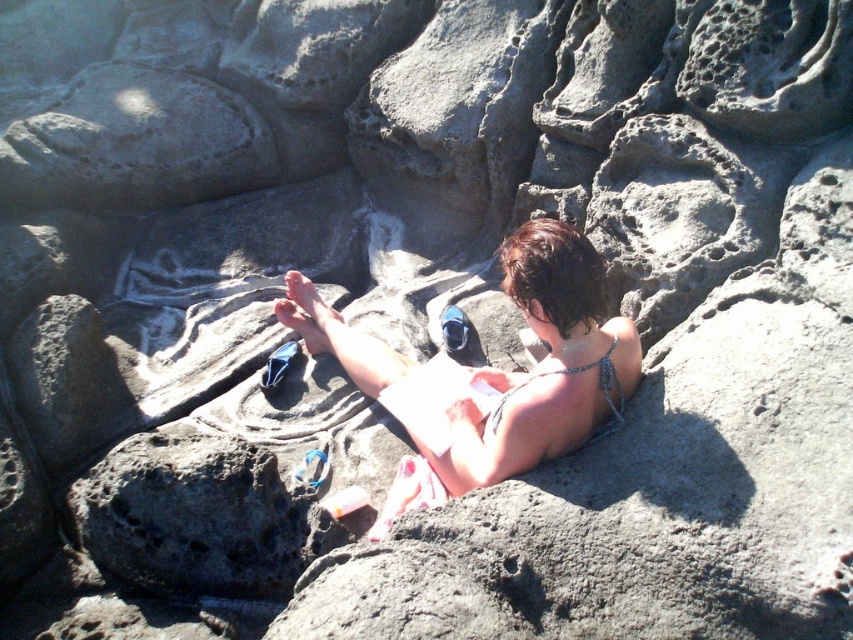
Question: Which of the following is the farthest from the observer?

Choices:
 (A) (585, 365)
 (B) (524, 445)

Answer: (A)

Question: Is white fabric bikini at center wider than sparkly silver bikini top at center?

Choices:
 (A) no
 (B) yes

Answer: (B)

Question: Observing the image, what is the correct spatial positioning of white fabric bikini at center in reference to sparkly silver bikini top at center?

Choices:
 (A) below
 (B) above

Answer: (B)

Question: Does white fabric bikini at center have a lesser width compared to sparkly silver bikini top at center?

Choices:
 (A) no
 (B) yes

Answer: (A)